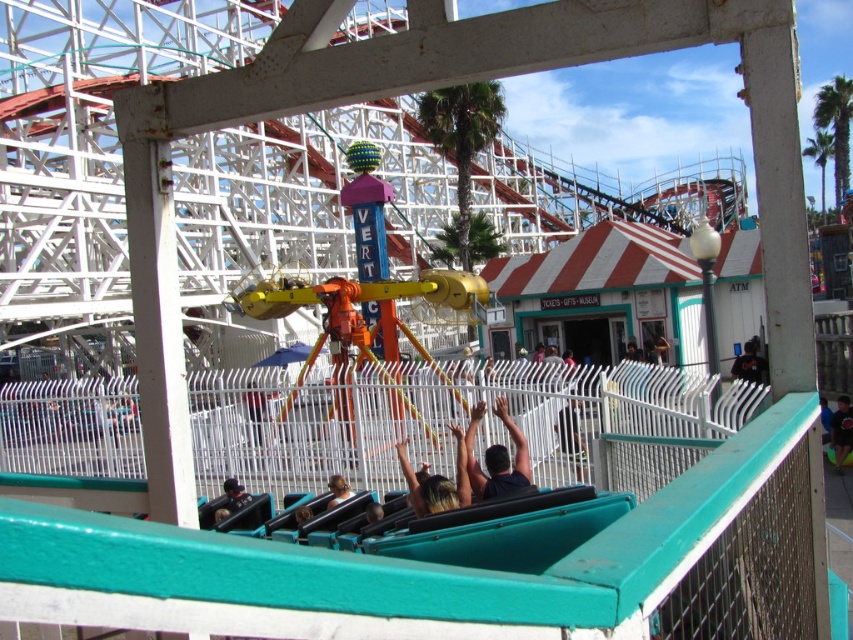
Question: Which point appears closest to the camera in this image?

Choices:
 (A) (231, 496)
 (B) (576, 419)

Answer: (A)

Question: Is the position of blonde hair at center less distant than that of light brown leather jacket at lower center?

Choices:
 (A) yes
 (B) no

Answer: (A)

Question: Does dark brown skin at center have a lesser width compared to blue t-shirt at center?

Choices:
 (A) yes
 (B) no

Answer: (A)

Question: Is dark brown skin at center thinner than dark brown leather jacket at center?

Choices:
 (A) yes
 (B) no

Answer: (A)

Question: Which of the following is the closest to the observer?

Choices:
 (A) (349, 488)
 (B) (573, 404)
 (C) (241, 504)

Answer: (C)

Question: Which point appears farthest from the camera in this image?

Choices:
 (A) (485, 452)
 (B) (560, 412)
 (C) (460, 452)

Answer: (B)